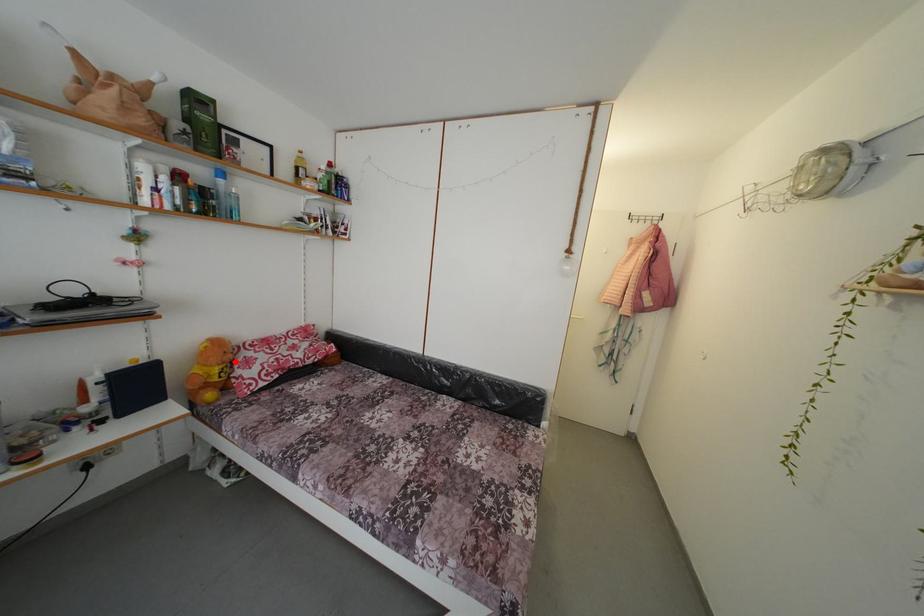
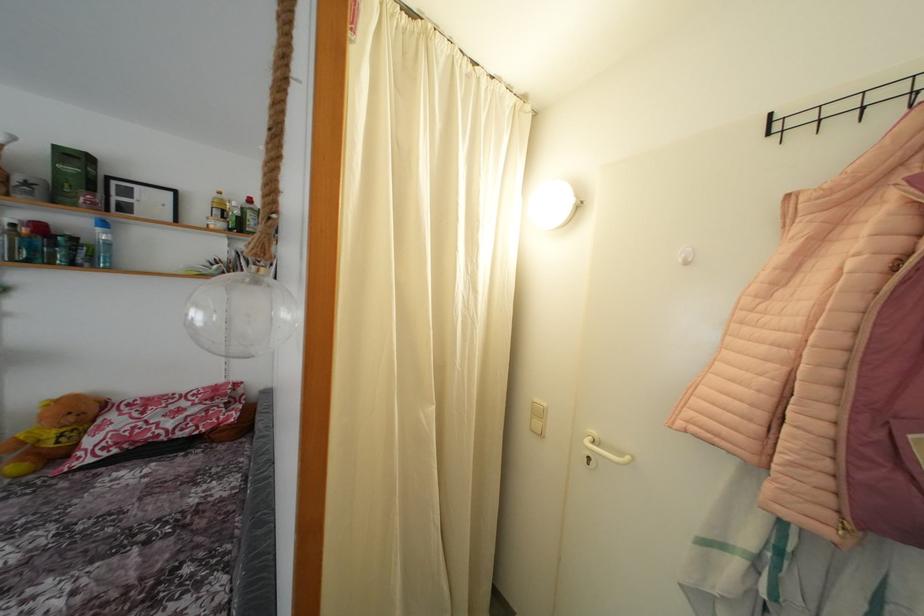
Where in the second image is the point corresponding to the highlighted location from the first image?

(77, 424)